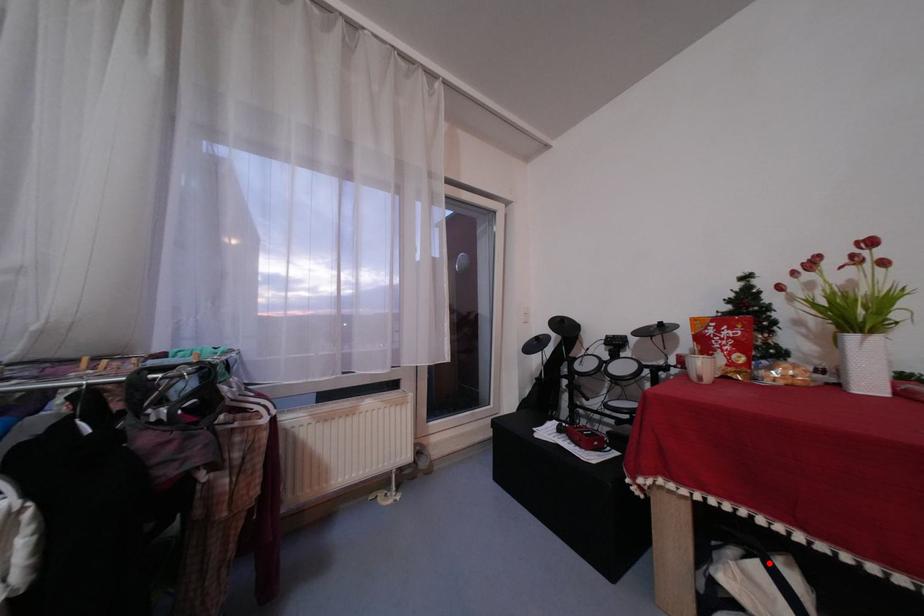
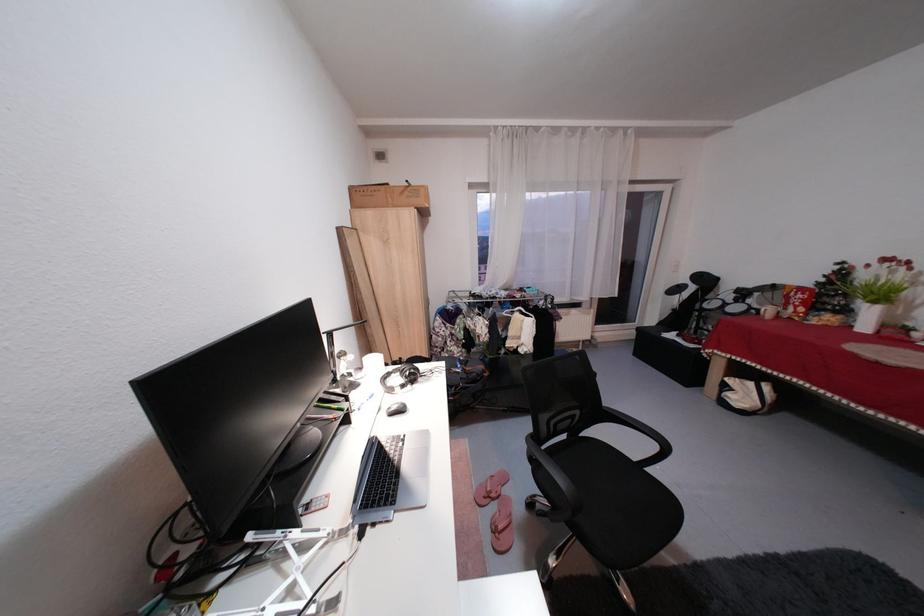
Find the pixel in the second image that matches the highlighted location in the first image.

(764, 384)